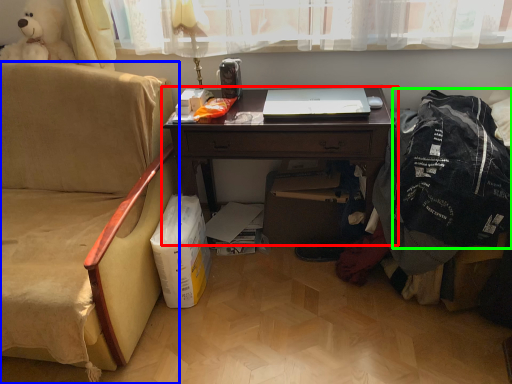
Question: Which object is the closest to the desk (highlighted by a red box)? Choose among these: chair (highlighted by a blue box) or clothing (highlighted by a green box).

Choices:
 (A) chair
 (B) clothing

Answer: (B)